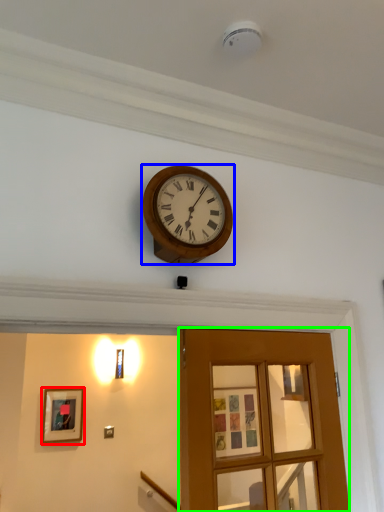
Question: Estimate the real-world distances between objects in this image. Which object is closer to picture frame (highlighted by a red box), wall clock (highlighted by a blue box) or door (highlighted by a green box)?

Choices:
 (A) wall clock
 (B) door

Answer: (B)